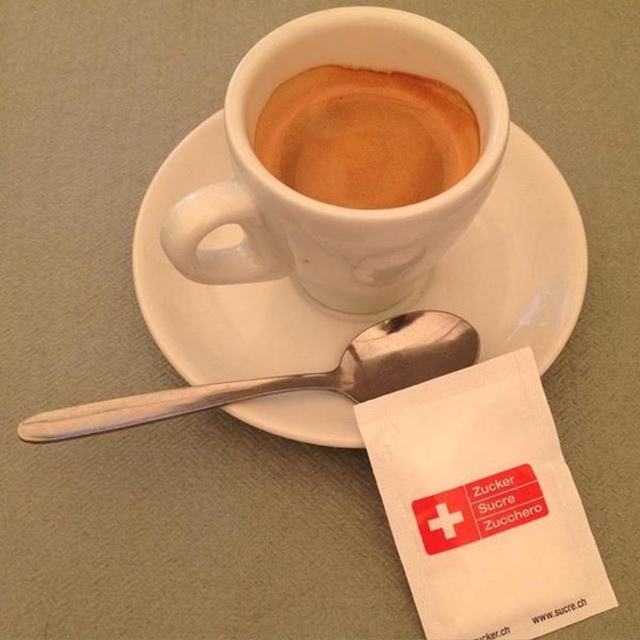
Question: Which point appears closest to the camera in this image?

Choices:
 (A) (406, 300)
 (B) (380, 349)

Answer: (B)

Question: Is brown matte cup at center further to the viewer compared to silver metallic spoon at center?

Choices:
 (A) no
 (B) yes

Answer: (A)

Question: Can you confirm if white ceramic saucer at upper center is bigger than brown matte cup at center?

Choices:
 (A) yes
 (B) no

Answer: (A)

Question: Which point appears farthest from the camera in this image?

Choices:
 (A) (291, 128)
 (B) (541, 314)

Answer: (B)

Question: Which point is farther from the camera taking this photo?

Choices:
 (A) (285, 131)
 (B) (163, 218)
 (C) (445, 332)

Answer: (B)

Question: From the image, what is the correct spatial relationship of white ceramic saucer at upper center in relation to silver metallic spoon at center?

Choices:
 (A) left
 (B) right

Answer: (B)